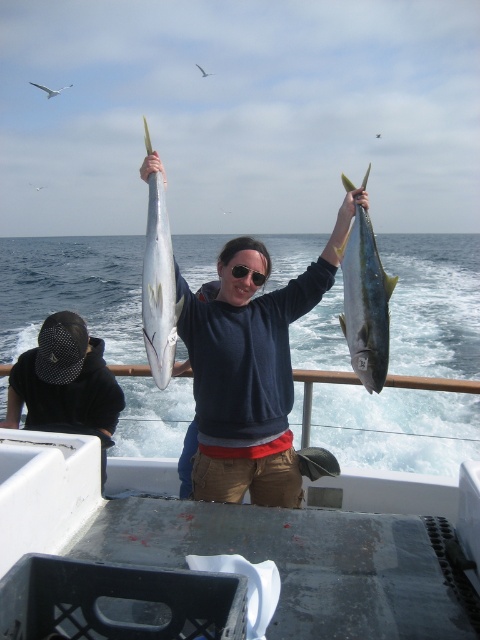
You are a photographer on the boat and want to take a closeup shot of the matte yellow fish at center and the black plastic sunglasses at upper center. Which object should you zoom in more on to ensure both fit in the frame?

Since the matte yellow fish at center is wider than the black plastic sunglasses at upper center, you should zoom in more on the black plastic sunglasses at upper center to ensure both fit in the frame.